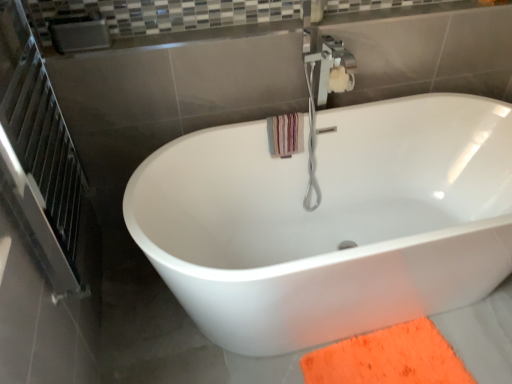
Image resolution: width=512 pixels, height=384 pixels. In order to click on free spot above orange fuzzy doormat at lower right (from a real-world perspective) in this screenshot , I will do `click(388, 359)`.